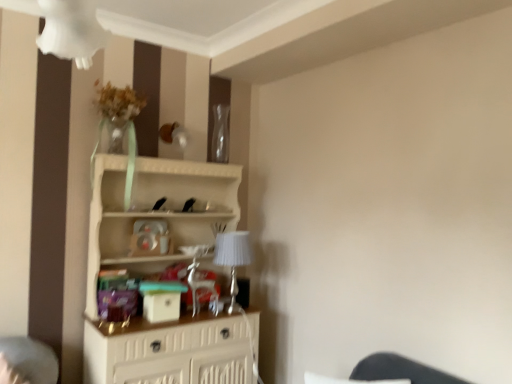
Question: Is silver metallic table lamp at center to the left or to the right of transparent glass vase at upper center in the image?

Choices:
 (A) right
 (B) left

Answer: (A)

Question: From the image's perspective, is silver metallic table lamp at center positioned above or below transparent glass vase at upper center?

Choices:
 (A) above
 (B) below

Answer: (B)

Question: Which of these objects is positioned farthest from the silver metallic table lamp at center?

Choices:
 (A) white wood shelf at center
 (B) transparent glass vase at upper center

Answer: (B)

Question: Based on their relative distances, which object is farther from the transparent glass vase at upper center?

Choices:
 (A) silver metallic table lamp at center
 (B) white wood shelf at center

Answer: (A)